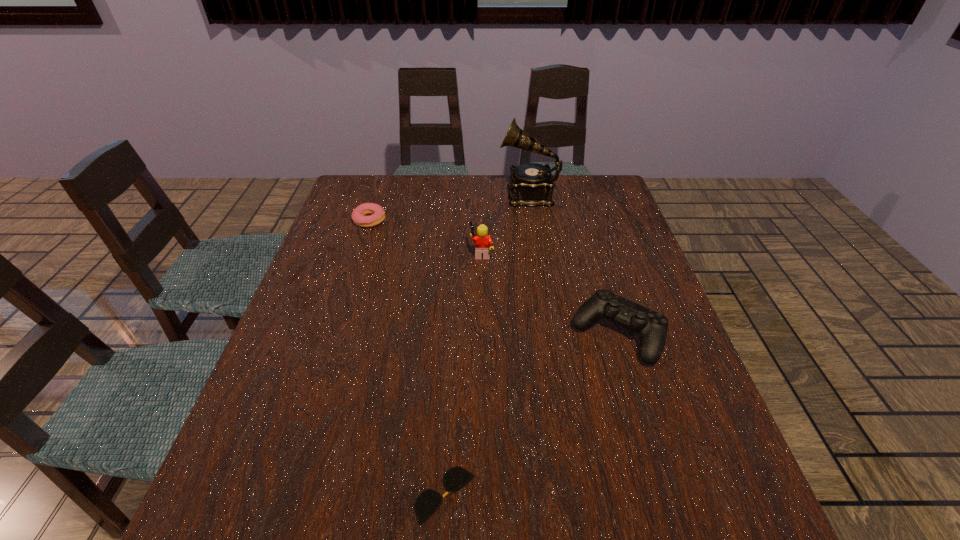
I want to click on doughnut that is at the far edge, so click(x=376, y=213).

Image resolution: width=960 pixels, height=540 pixels. I want to click on object present at the near edge, so click(x=429, y=500).

Locate an element on the screen. This screenshot has height=540, width=960. object present at the left edge is located at coordinates (376, 213).

I want to click on object that is at the right edge, so click(652, 326).

At what (x,y) coordinates should I click in order to perform the action: click on object located at the far left corner. Please return your answer as a coordinate pair (x, y). This screenshot has height=540, width=960. Looking at the image, I should click on (376, 213).

Find the location of a particular element. vacant space at the far edge is located at coordinates (484, 190).

Locate an element on the screen. Image resolution: width=960 pixels, height=540 pixels. vacant space at the left edge of the desktop is located at coordinates (316, 254).

Where is `vacant space at the right edge of the desktop`? vacant space at the right edge of the desktop is located at coordinates (582, 228).

At what (x,y) coordinates should I click in order to perform the action: click on free space at the far right corner of the desktop. Please return your answer as a coordinate pair (x, y). Looking at the image, I should click on (600, 194).

Identify the location of vacant space that is in between the spectacles and the control. (531, 414).